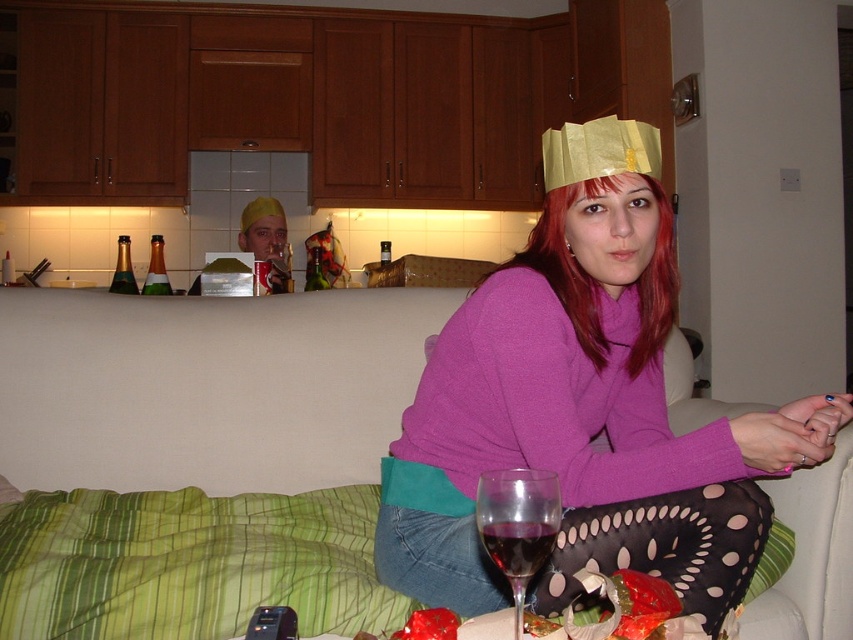
From the picture: Where is the matte gold crown at upper center located in the image?

The matte gold crown at upper center is located at point coordinates of (584, 406).

You are planning to place the gold paper crown at upper center and the matte yellow cap at center on a shelf. Which object should you place first if you want to arrange them from smallest to largest?

The gold paper crown at upper center is smaller than the matte yellow cap at center, so you should place the gold paper crown at upper center first when arranging from smallest to largest.

You are planning to place a rectangular box that is 1.2 meters long on the green fabric couch at lower center. Can the dark purple glass at lower center fit on the remaining space of the couch after placing the box?

The green fabric couch at lower center might be wider than the dark purple glass at lower center, so it is possible that there will be enough space left on the couch after placing the box to accommodate the dark purple glass at lower center. However, without exact measurements, this cannot be confirmed with certainty.